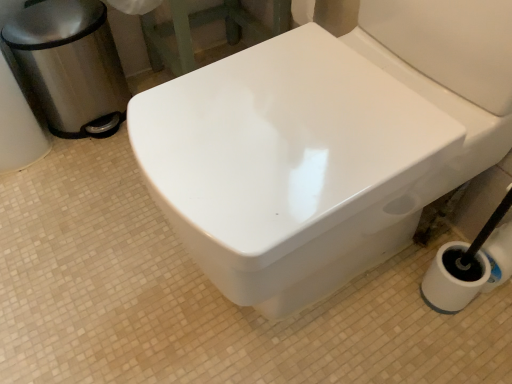
Where is `vacant area on top of polished stainless steel trash can at left (from a real-world perspective)`? vacant area on top of polished stainless steel trash can at left (from a real-world perspective) is located at coordinates (54, 14).